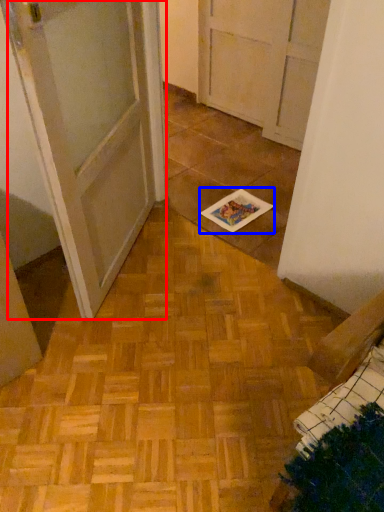
Question: Which point is further to the camera, door (highlighted by a red box) or book (highlighted by a blue box)?

Choices:
 (A) door
 (B) book

Answer: (B)